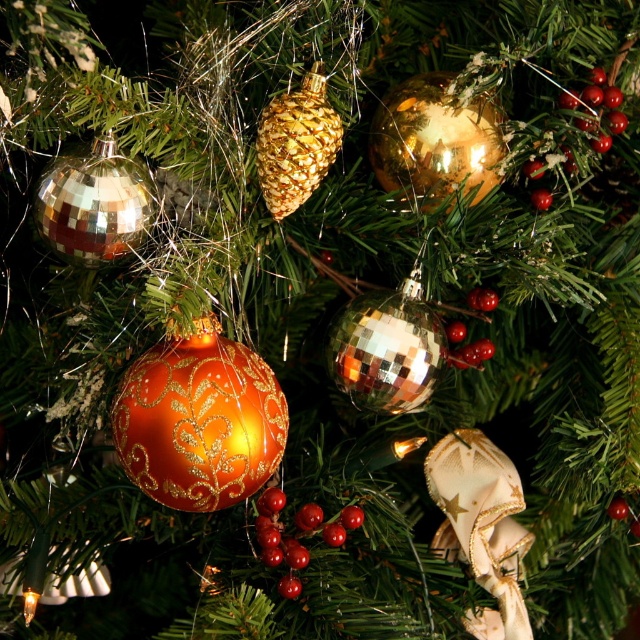
Question: Can you confirm if shiny red berries at center is smaller than glossy red berry at upper right?

Choices:
 (A) no
 (B) yes

Answer: (A)

Question: Which of the following is the farthest from the observer?

Choices:
 (A) (317, 122)
 (B) (531, 202)
 (C) (273, 492)
 (D) (486, 292)

Answer: (D)

Question: Which object is closer to the camera taking this photo?

Choices:
 (A) glossy red berry at upper right
 (B) gold textured pine cone at center

Answer: (B)

Question: Does glossy red berry at center have a larger size compared to glossy red berry at upper right?

Choices:
 (A) no
 (B) yes

Answer: (B)

Question: Does shiny red berries at center appear on the left side of glossy red berry at upper right?

Choices:
 (A) yes
 (B) no

Answer: (A)

Question: Which object appears closest to the camera in this image?

Choices:
 (A) shiny red berries at center
 (B) glossy red berry at upper right
 (C) glossy red berry at center
 (D) gold textured pine cone at center

Answer: (D)